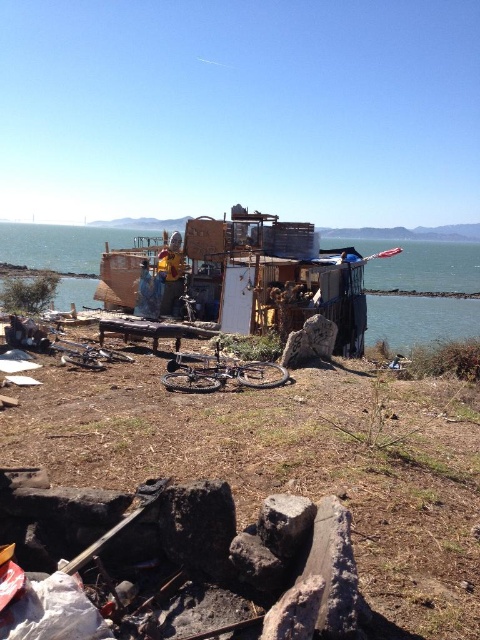
You are standing in front of the structure and want to walk towards the blue water at center. Which direction should you walk relative to the gray rough stone at center?

The blue water at center is positioned on the left side of the gray rough stone at center, so you should walk to the left of the gray rough stone at center to reach the blue water at center.

Looking at this image, you are standing in front of the structure and want to take a photo that includes both point (370, 492) and point (72, 262). Since the structure is in the way, which point should you move towards to ensure both points are visible in your photo?

You should move towards point (72, 262) because it is farther from the camera, so moving towards it would allow both points to be visible by adjusting your position around the structure.

You are standing in front of the structure and want to reach the blue water at center. Which direction should you move relative to the structure?

The blue water at center is located at point (420, 266) in 2D coordinates, so you should move towards the lower right direction relative to the structure.